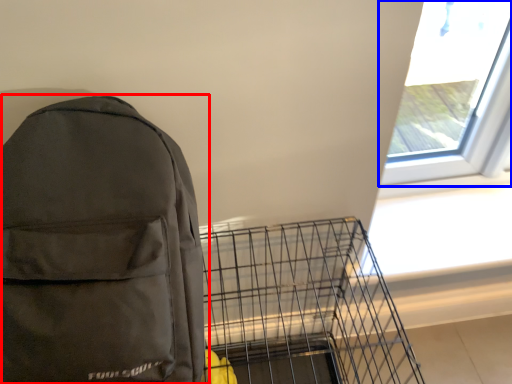
Question: Which point is further to the camera, backpack (highlighted by a red box) or window (highlighted by a blue box)?

Choices:
 (A) backpack
 (B) window

Answer: (B)